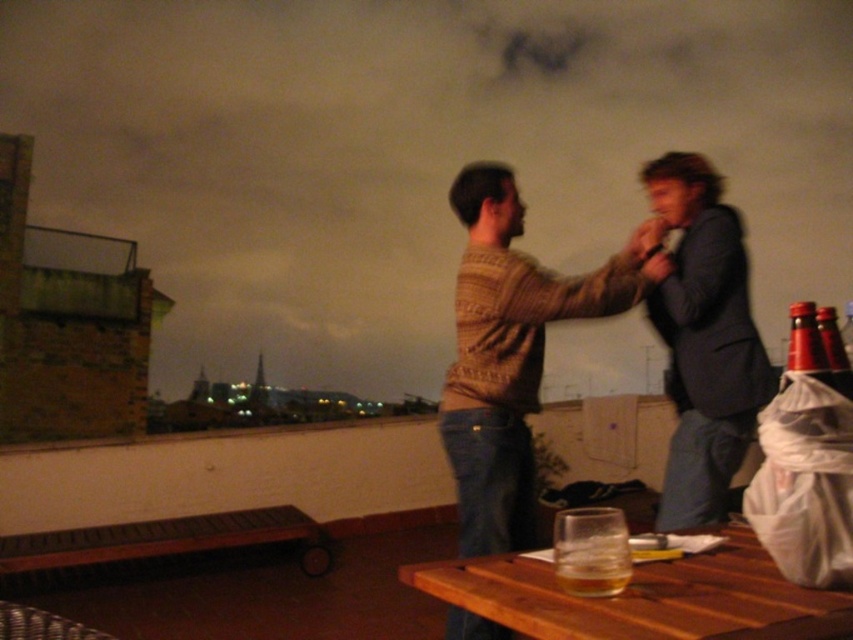
You are planning to place a small potted plant on the table. Given the size of the brown wooden picnic table at lower left and the red glass bottle at right, which object would be more suitable for placing the plant?

The brown wooden picnic table at lower left is bigger than the red glass bottle at right, so the brown wooden picnic table at lower left would be more suitable for placing the small potted plant.

You are planning to place a large potted plant on the table in the scene. The plant requires a stable surface. Which object from the brown wooden picnic table at lower left and the translucent glass at table center should you choose?

The brown wooden picnic table at lower left is positioned on the left side of the translucent glass at table center. Since the picnic table is made of wood, it is more stable than the glass surface, so you should choose the brown wooden picnic table at lower left for placing the large potted plant.